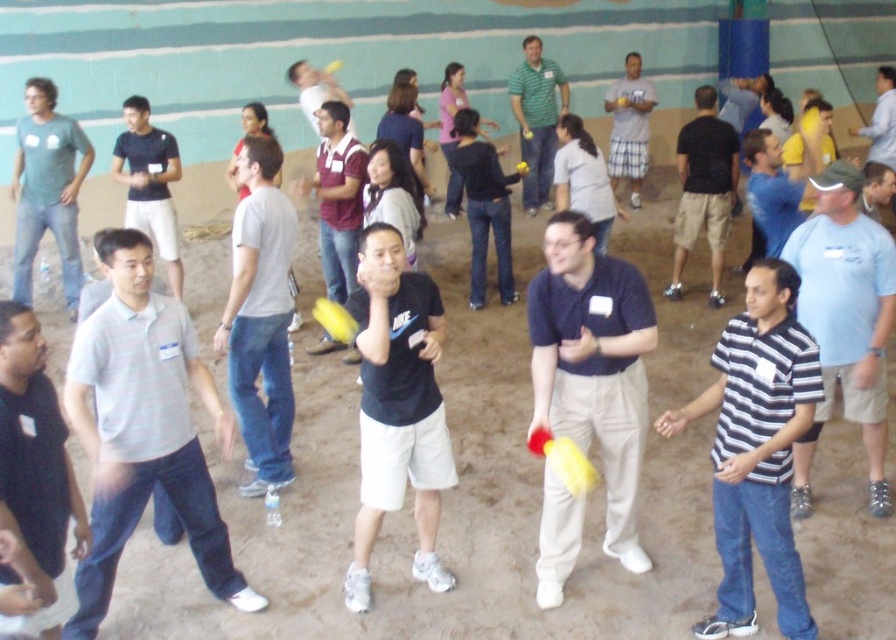
Between dark gray shirt at left and light blue shirt at upper right, which one is positioned higher?

light blue shirt at upper right

Consider the image. Which is below, dark gray shirt at left or light blue shirt at upper right?

dark gray shirt at left

What do you see at coordinates (35, 467) in the screenshot?
I see `dark gray shirt at left` at bounding box center [35, 467].

Where is `dark gray shirt at left`? This screenshot has height=640, width=896. dark gray shirt at left is located at coordinates (35, 467).

In the scene shown: Is black matte t-shirt at center bigger than light gray cotton t-shirt at center?

Correct, black matte t-shirt at center is larger in size than light gray cotton t-shirt at center.

What do you see at coordinates (397, 406) in the screenshot? I see `black matte t-shirt at center` at bounding box center [397, 406].

Identify the location of black matte t-shirt at center. Image resolution: width=896 pixels, height=640 pixels. (397, 406).

Which of these two, striped cotton shirt at center or black matte t-shirt at center, stands taller?

black matte t-shirt at center is taller.

Who is more forward, (735, 444) or (416, 492)?

Point (735, 444)

Which is behind, point (727, 392) or point (378, 339)?

The point (727, 392) is more distant.

Find the location of a particular element. striped cotton shirt at center is located at coordinates (757, 449).